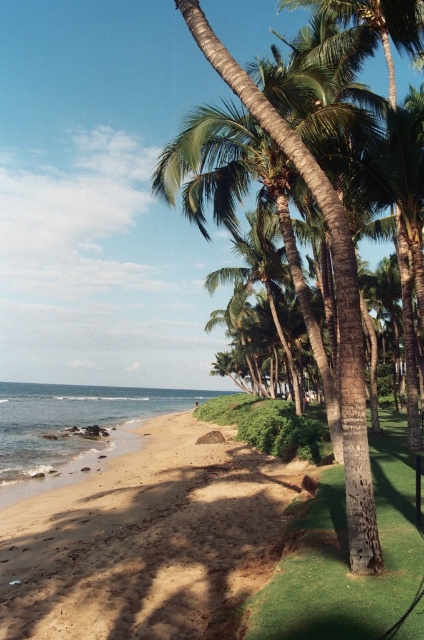
Who is shorter, brown sandy beach at lower left or green artificial turf at center?

With less height is green artificial turf at center.

Measure the distance between point (x=16, y=554) and camera.

Point (x=16, y=554) and camera are 10.22 meters apart.

Is point (108, 632) closer to viewer compared to point (371, 582)?

No, it is behind (371, 582).

You are a GUI agent. You are given a task and a screenshot of the screen. Output one action in this format:
    pyautogui.click(x=<x>, y=<y>)
    Task: Click on the brown sandy beach at lower left
    The image size is (424, 640).
    Given the screenshot: What is the action you would take?
    tap(147, 540)

Is brown sandy beach at lower left bigger than green textured palm tree at center?

Actually, brown sandy beach at lower left might be smaller than green textured palm tree at center.

Which of these two, brown sandy beach at lower left or green textured palm tree at center, stands taller?

green textured palm tree at center

Image resolution: width=424 pixels, height=640 pixels. In order to click on brown sandy beach at lower left in this screenshot , I will do `click(147, 540)`.

Can you confirm if green artificial turf at center is thinner than clear water at lower left?

Correct, green artificial turf at center's width is less than clear water at lower left's.

Is point (379, 621) more distant than point (14, 474)?

No, (379, 621) is closer to viewer.

Does point (412, 490) lie in front of point (22, 451)?

Yes, it is.

In order to click on green artificial turf at center in this screenshot , I will do `click(345, 554)`.